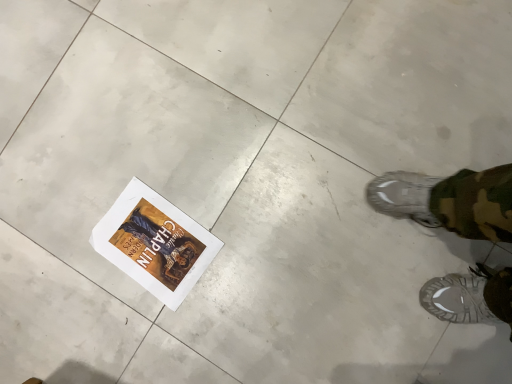
The image size is (512, 384). I want to click on empty space that is ontop of white paper postcard at lower left (from a real-world perspective), so click(142, 234).